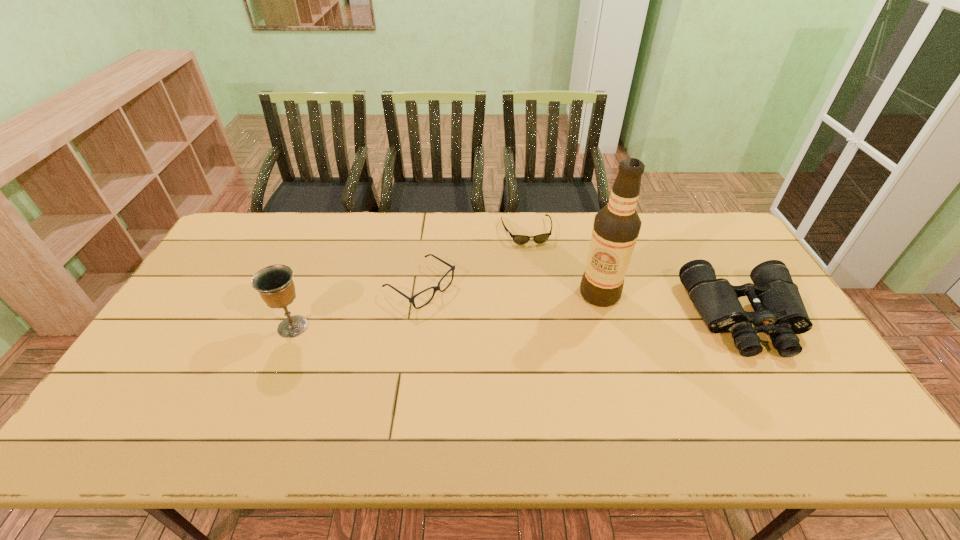
You are a GUI agent. You are given a task and a screenshot of the screen. Output one action in this format:
    pyautogui.click(x=<x>, y=<y>)
    Task: Click on the free spot on the desktop that is between the chalice and the binoculars and is positioned on the label of the alcohol
    The image size is (960, 540).
    Given the screenshot: What is the action you would take?
    pyautogui.click(x=544, y=321)

Where is `free space on the desktop that is between the chalice and the rightmost object and is positioned on the front-facing side of the second object from left to right`? The height and width of the screenshot is (540, 960). free space on the desktop that is between the chalice and the rightmost object and is positioned on the front-facing side of the second object from left to right is located at coordinates (476, 323).

You are a GUI agent. You are given a task and a screenshot of the screen. Output one action in this format:
    pyautogui.click(x=<x>, y=<y>)
    Task: Click on the free space on the desktop that is between the leftmost object and the binoculars and is positioned on the front-facing side of the shortest object
    The image size is (960, 540).
    Given the screenshot: What is the action you would take?
    pyautogui.click(x=551, y=321)